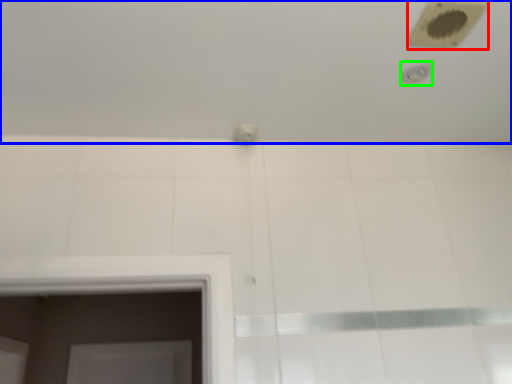
Question: Which object is the farthest from hole (highlighted by a red box)? Choose among these: bath (highlighted by a blue box) or shower (highlighted by a green box).

Choices:
 (A) bath
 (B) shower

Answer: (A)